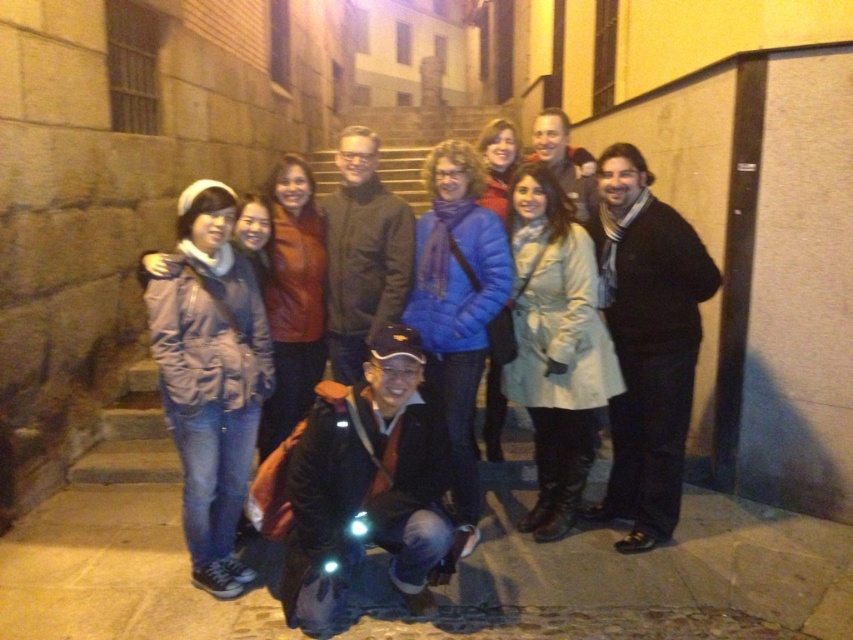
Who is positioned more to the right, black wool scarf at right or dark brown leather jacket at center?

Positioned to the right is black wool scarf at right.

Is black wool scarf at right bigger than dark brown leather jacket at center?

Correct, black wool scarf at right is larger in size than dark brown leather jacket at center.

Does point (670, 346) come closer to viewer compared to point (328, 266)?

That is True.

Locate an element on the screen. The image size is (853, 640). black wool scarf at right is located at coordinates (647, 342).

Between black wool scarf at right and matte black jacket at center, which one appears on the left side from the viewer's perspective?

Positioned to the left is matte black jacket at center.

Is black wool scarf at right to the right of matte black jacket at center from the viewer's perspective?

Yes, black wool scarf at right is to the right of matte black jacket at center.

Between point (650, 512) and point (585, 196), which one is positioned in front?

Positioned in front is point (650, 512).

Image resolution: width=853 pixels, height=640 pixels. Find the location of `black wool scarf at right`. black wool scarf at right is located at coordinates (647, 342).

Between dark blue jacket at center and matte purple jacket at left, which one appears on the right side from the viewer's perspective?

dark blue jacket at center is more to the right.

Can you confirm if dark blue jacket at center is taller than matte purple jacket at left?

In fact, dark blue jacket at center may be shorter than matte purple jacket at left.

The height and width of the screenshot is (640, 853). In order to click on dark blue jacket at center in this screenshot , I will do `click(367, 483)`.